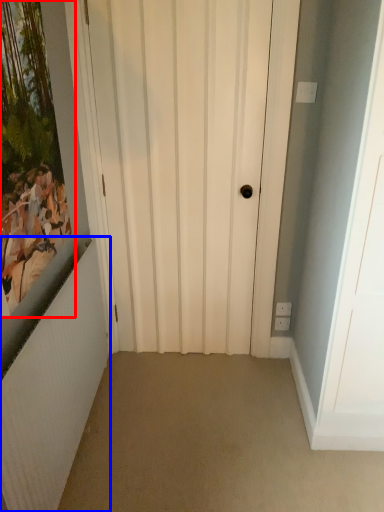
Question: Which of the following is the closest to the observer, picture frame (highlighted by a red box) or radiator (highlighted by a blue box)?

Choices:
 (A) picture frame
 (B) radiator

Answer: (A)